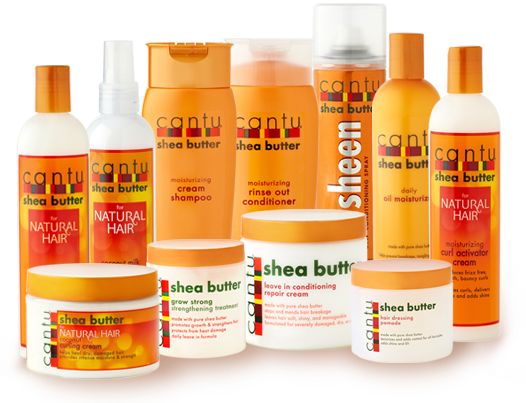
Locate an element on the screen. This screenshot has height=403, width=526. jar lids is located at coordinates (100, 292), (170, 259), (283, 230), (401, 282).